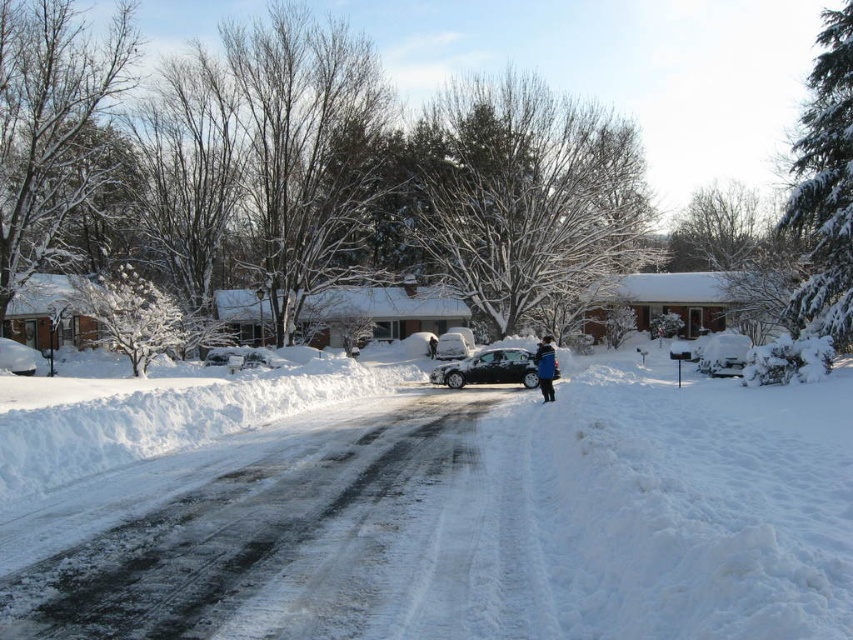
Question: Which of these objects is positioned closest to the black matte car at center?

Choices:
 (A) blue fleece jacket at center
 (B) white fluffy snow at center

Answer: (A)

Question: In this image, where is black matte car at center located relative to blue fleece jacket at center?

Choices:
 (A) above
 (B) below

Answer: (B)

Question: Can you confirm if black matte car at center is positioned to the right of blue fleece jacket at center?

Choices:
 (A) yes
 (B) no

Answer: (B)

Question: Which point is closer to the camera?

Choices:
 (A) (62, 529)
 (B) (549, 369)

Answer: (A)

Question: Can you confirm if white fluffy snow at center is thinner than black matte car at center?

Choices:
 (A) no
 (B) yes

Answer: (A)

Question: Among these objects, which one is nearest to the camera?

Choices:
 (A) black matte car at center
 (B) white fluffy snow at center

Answer: (B)